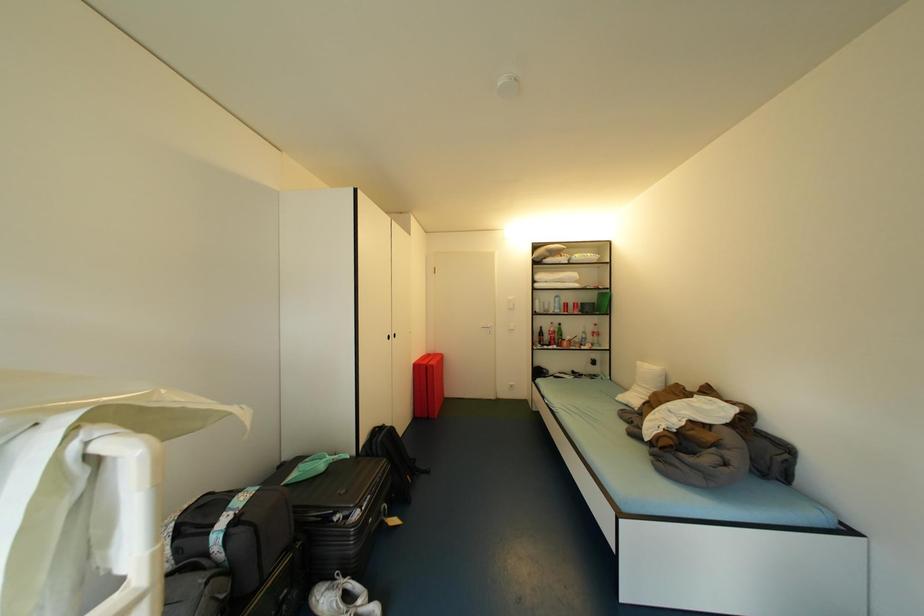
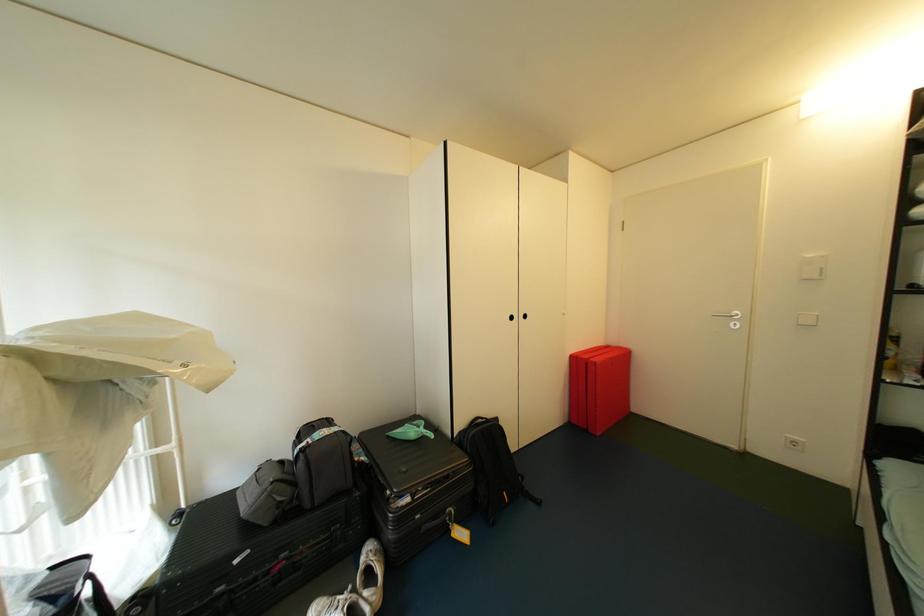
Question: The images are taken continuously from a first-person perspective. In which direction is your viewpoint rotating?

Choices:
 (A) Left
 (B) Right
 (C) Up
 (D) Down

Answer: (A)